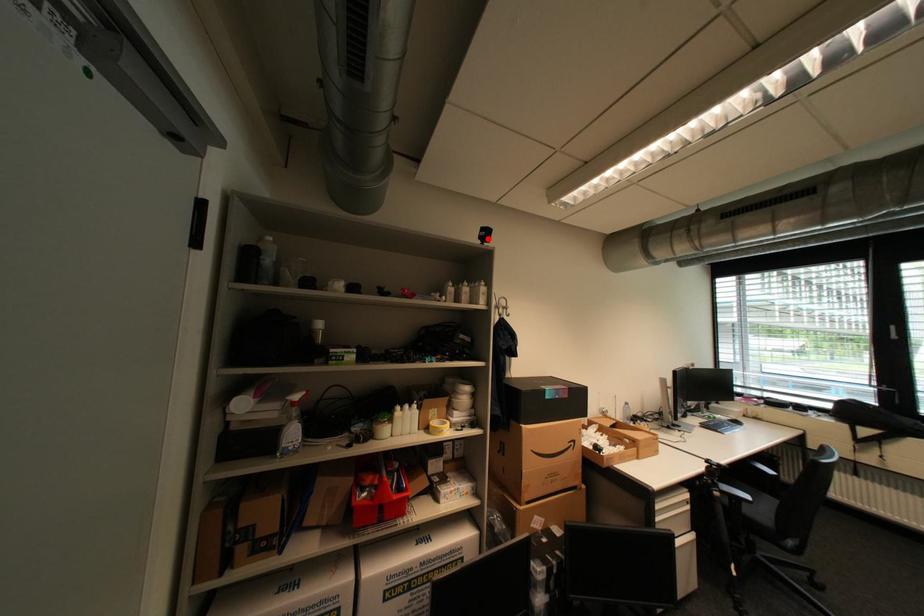
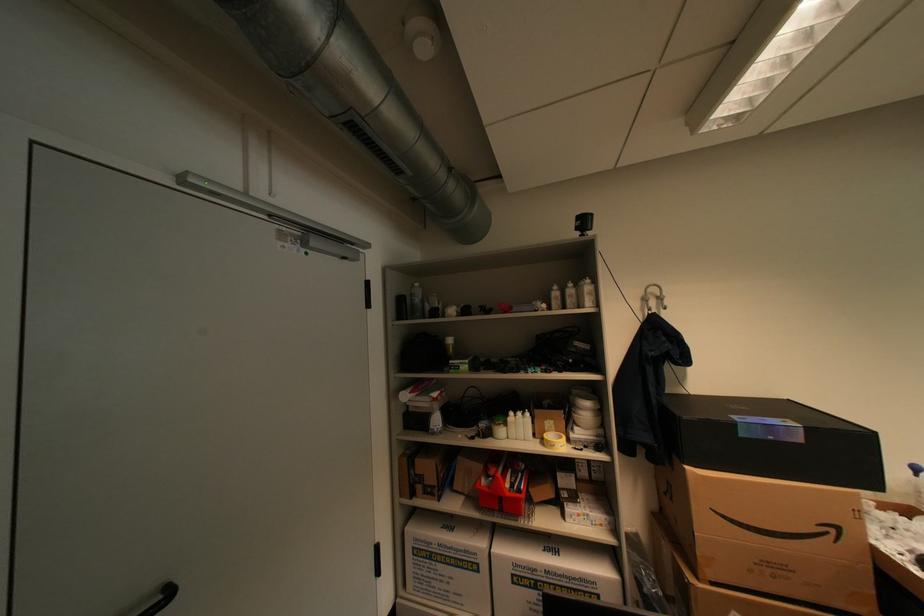
Question: I am providing you with two images of the same scene from different viewpoints. A red point is marked on the first image. Can you still see the location of the red point in image 2?

Choices:
 (A) Yes
 (B) No

Answer: (A)